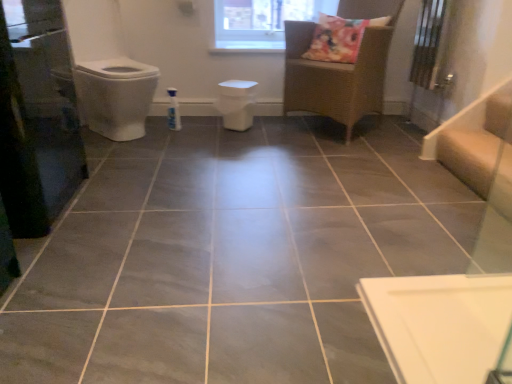
Question: Should I look upward or downward to see transparent glass screen door at left?

Choices:
 (A) up
 (B) down

Answer: (A)

Question: Should I look upward or downward to see transparent glass window at upper center?

Choices:
 (A) down
 (B) up

Answer: (B)

Question: Is woven rattan chair at upper center facing towards beige wood stairwell at right?

Choices:
 (A) yes
 (B) no

Answer: (B)

Question: Can you confirm if woven rattan chair at upper center is positioned to the left of beige wood stairwell at right?

Choices:
 (A) yes
 (B) no

Answer: (A)

Question: Does woven rattan chair at upper center lie in front of beige wood stairwell at right?

Choices:
 (A) no
 (B) yes

Answer: (A)

Question: From the image's perspective, is woven rattan chair at upper center located beneath beige wood stairwell at right?

Choices:
 (A) no
 (B) yes

Answer: (A)

Question: Is woven rattan chair at upper center not within beige wood stairwell at right?

Choices:
 (A) no
 (B) yes

Answer: (B)

Question: Would you say beige wood stairwell at right is part of woven rattan chair at upper center's contents?

Choices:
 (A) yes
 (B) no

Answer: (B)

Question: Can white matte toilet bowl at center be found inside woven rattan chair at upper center?

Choices:
 (A) yes
 (B) no

Answer: (B)

Question: Is woven rattan chair at upper center looking in the opposite direction of white matte toilet bowl at center?

Choices:
 (A) no
 (B) yes

Answer: (A)

Question: From a real-world perspective, is woven rattan chair at upper center located beneath white matte toilet bowl at center?

Choices:
 (A) no
 (B) yes

Answer: (A)

Question: Is woven rattan chair at upper center shorter than white matte toilet bowl at center?

Choices:
 (A) no
 (B) yes

Answer: (A)

Question: Is woven rattan chair at upper center wider than white matte toilet bowl at center?

Choices:
 (A) no
 (B) yes

Answer: (B)

Question: Is woven rattan chair at upper center smaller than white matte toilet bowl at center?

Choices:
 (A) yes
 (B) no

Answer: (B)

Question: Is white matte toilet bowl at center at the right side of transparent glass window at upper center?

Choices:
 (A) no
 (B) yes

Answer: (A)